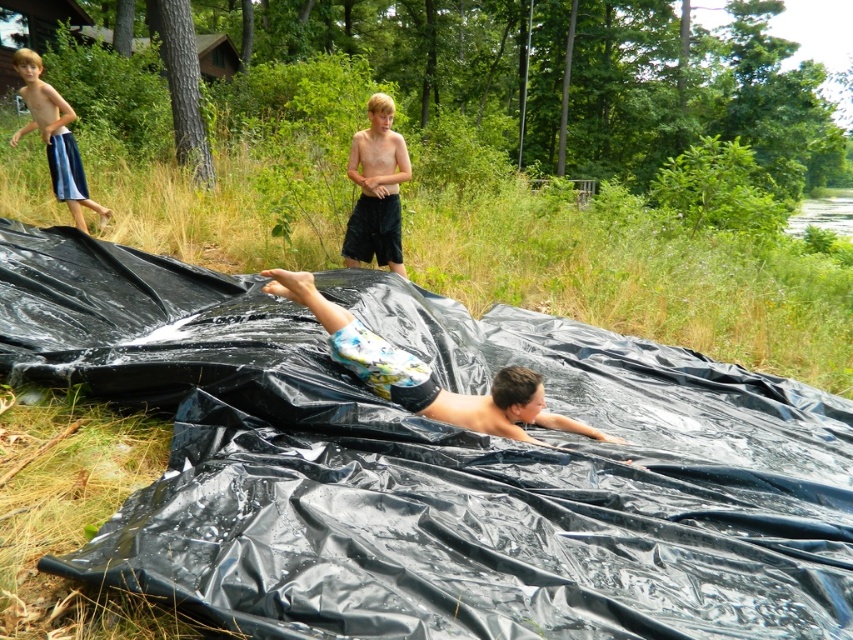
Question: Can you confirm if black plastic tarp at center is positioned below floral shorts at center?

Choices:
 (A) yes
 (B) no

Answer: (B)

Question: Is floral shorts at center wider than light brown shorts at upper center?

Choices:
 (A) no
 (B) yes

Answer: (B)

Question: Which of the following is the closest to the observer?

Choices:
 (A) green grass at lower center
 (B) blue striped shorts at upper left

Answer: (A)

Question: Which object is the closest to the floral shorts at center?

Choices:
 (A) black plastic tarp at center
 (B) green grass at lower center

Answer: (A)

Question: Estimate the real-world distances between objects in this image. Which object is farther from the blue striped shorts at upper left?

Choices:
 (A) light brown shorts at upper center
 (B) green grass at lower center
 (C) floral shorts at center
 (D) black plastic tarp at center

Answer: (C)

Question: Is green grass at lower center to the right of blue striped shorts at upper left from the viewer's perspective?

Choices:
 (A) yes
 (B) no

Answer: (A)